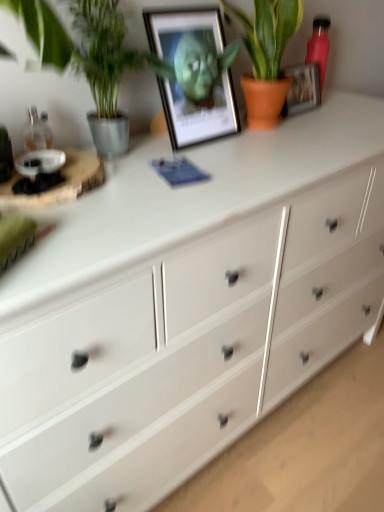
Find the location of a particular element. The width and height of the screenshot is (384, 512). unoccupied area in front of green leafy plant at left, which is the second houseplant in right-to-left order is located at coordinates (132, 188).